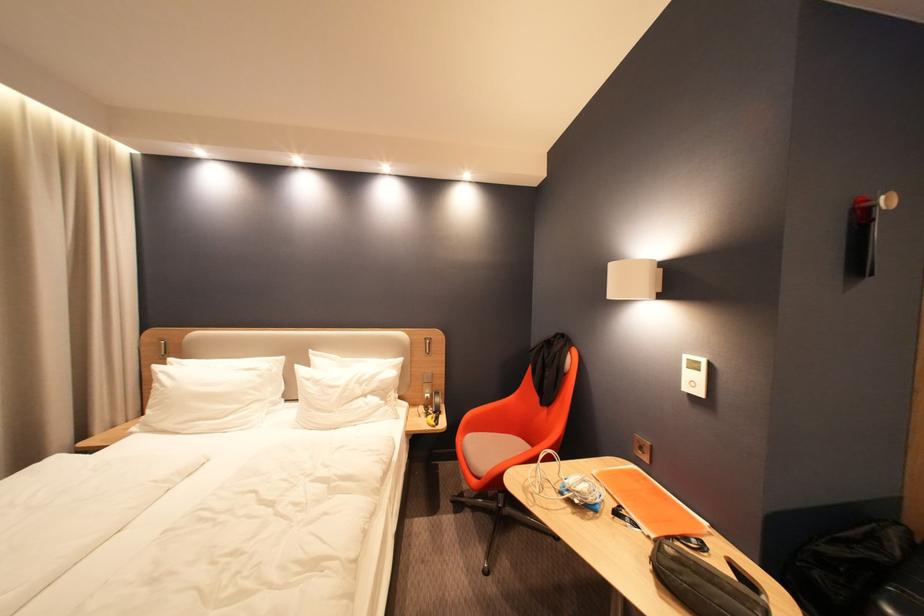
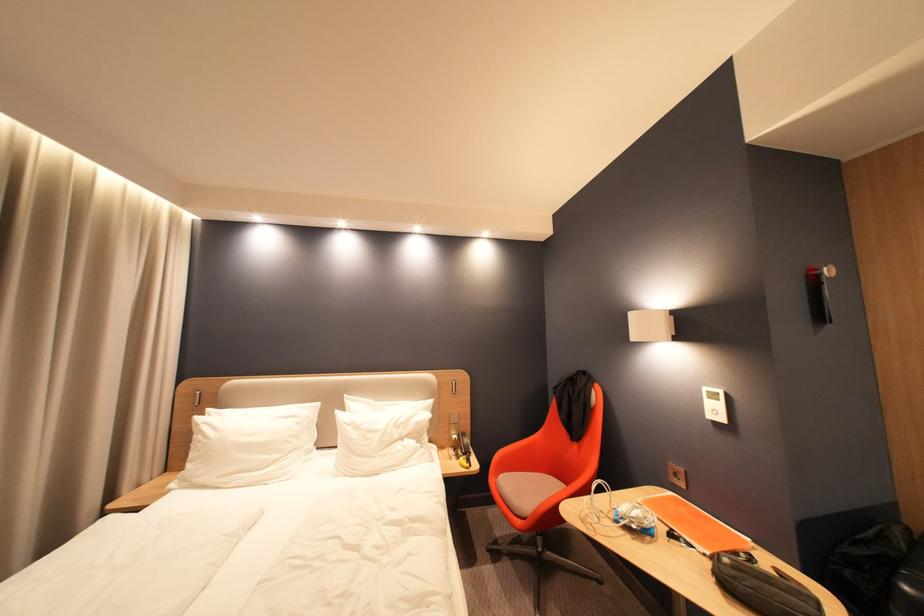
Locate, in the second image, the point that corresponds to pixel 659 538 in the first image.

(714, 556)